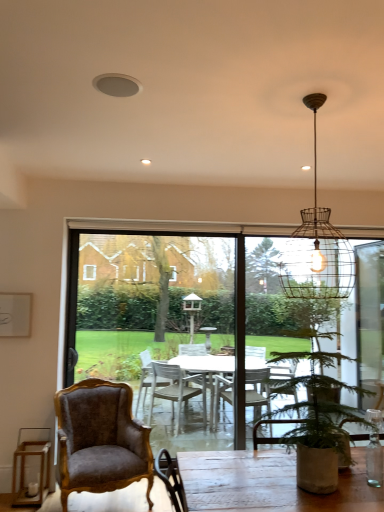
You are a GUI agent. You are given a task and a screenshot of the screen. Output one action in this format:
    pyautogui.click(x=<x>, y=<y>)
    Task: Click on the blank space situated above wire mesh pendant light at upper center (from a real-world perspective)
    This screenshot has height=512, width=384.
    Given the screenshot: What is the action you would take?
    pyautogui.click(x=321, y=95)